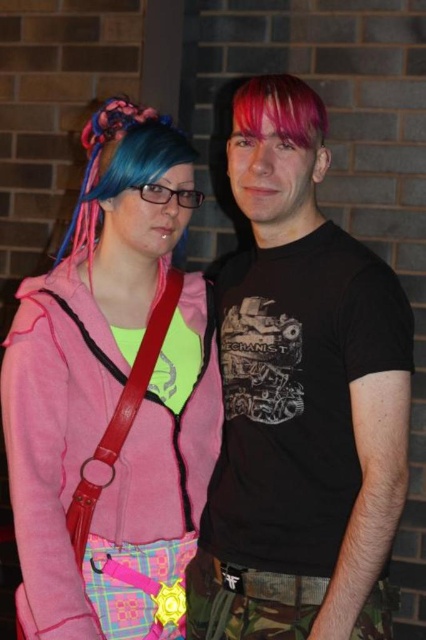
Is point (146, 118) closer to camera compared to point (321, 129)?

No, (146, 118) is further to viewer.

Consider the image. How far apart are matte pink hoodie at center and pink matte hair at center?

matte pink hoodie at center is 19.81 inches from pink matte hair at center.

Is point (49, 273) closer to viewer compared to point (252, 120)?

No, (49, 273) is further to viewer.

This screenshot has width=426, height=640. I want to click on matte pink hoodie at center, so click(112, 397).

Does black matte t-shirt at center have a lesser width compared to blue dyed hair at center?

No, black matte t-shirt at center is not thinner than blue dyed hair at center.

Does point (247, 436) come in front of point (92, 148)?

Yes, it is.

Does point (405, 483) lie in front of point (135, 132)?

Yes, point (405, 483) is in front of point (135, 132).

Identify the location of black matte t-shirt at center. (301, 400).

Between point (307, 452) and point (143, 586), which one is positioned in front?

Positioned in front is point (307, 452).

What are the coordinates of `black matte t-shirt at center` in the screenshot? It's located at (301, 400).